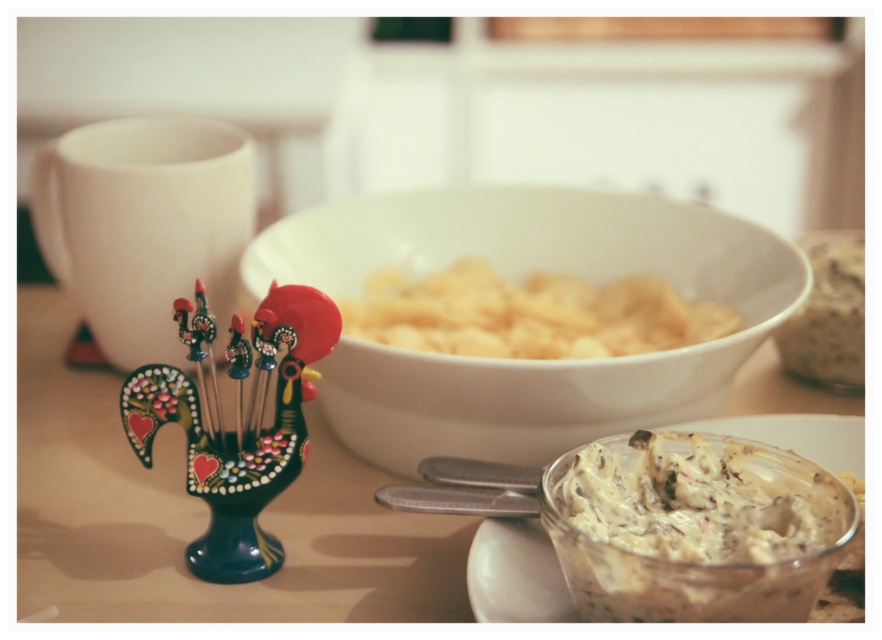
Question: Among these points, which one is nearest to the camera?

Choices:
 (A) (858, 268)
 (B) (365, 230)

Answer: (A)

Question: Based on their relative distances, which object is farther from the painted ceramic rooster at left?

Choices:
 (A) white creamy dip at center
 (B) smooth brown bread at right
 (C) white matte bowl at center

Answer: (B)

Question: Which point appears farthest from the camera in this image?

Choices:
 (A) (697, 250)
 (B) (527, 337)
 (C) (582, 531)
 (D) (780, 355)

Answer: (D)

Question: Is white matte bowl at center smaller than white matte chips at center?

Choices:
 (A) yes
 (B) no

Answer: (B)

Question: Is white matte bowl at center below smooth brown bread at right?

Choices:
 (A) yes
 (B) no

Answer: (A)

Question: Can you confirm if white matte bowl at center is bigger than white creamy dip at center?

Choices:
 (A) yes
 (B) no

Answer: (A)